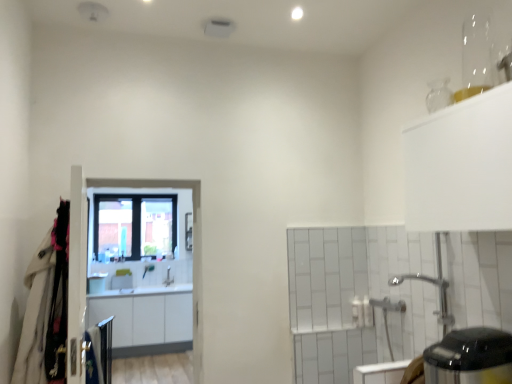
Question: Based on their positions, is white glossy screen door at center located to the left or right of white glossy cabinets at center?

Choices:
 (A) left
 (B) right

Answer: (B)

Question: Is white glossy screen door at center inside the boundaries of white glossy cabinets at center, or outside?

Choices:
 (A) outside
 (B) inside

Answer: (A)

Question: Estimate the real-world distances between objects in this image. Which object is farther from the white glossy screen door at center?

Choices:
 (A) silver metallic faucet at center
 (B) white glossy cabinets at center
 (C) clear glass window at center
 (D) black glossy electric kettle at lower right
 (E) white fabric coat at left

Answer: (D)

Question: Estimate the real-world distances between objects in this image. Which object is farther from the silver metallic faucet at center?

Choices:
 (A) white glossy screen door at center
 (B) white fabric coat at left
 (C) black glossy electric kettle at lower right
 (D) clear glass window at center
 (E) white glossy cabinets at center

Answer: (C)